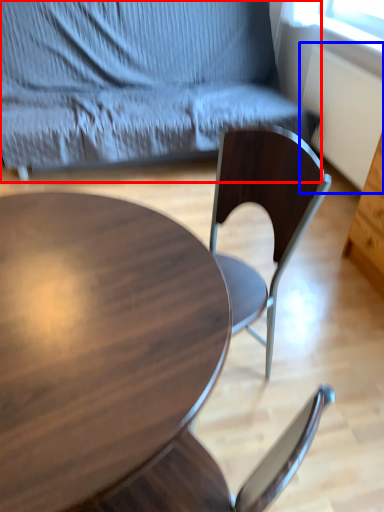
Question: Which of the following is the farthest to the observer, chair (highlighted by a red box) or radiator (highlighted by a blue box)?

Choices:
 (A) chair
 (B) radiator

Answer: (B)